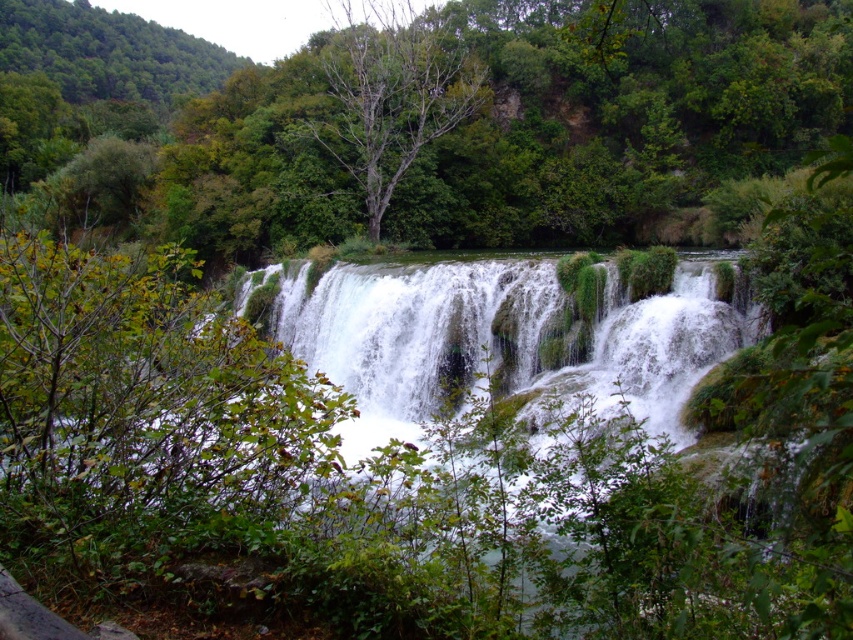
Can you confirm if green leafy tree at center is positioned to the left of bare wood tree at center?

Indeed, green leafy tree at center is positioned on the left side of bare wood tree at center.

Is the position of green leafy tree at center more distant than that of bare wood tree at center?

No, green leafy tree at center is in front of bare wood tree at center.

This screenshot has width=853, height=640. What do you see at coordinates (422, 120) in the screenshot? I see `green leafy tree at center` at bounding box center [422, 120].

This screenshot has height=640, width=853. What are the coordinates of `green leafy tree at center` in the screenshot? It's located at (422, 120).

Between point (488, 259) and point (422, 144), which one is positioned in front?

Point (488, 259)

Does white frothy water at center have a larger size compared to bare wood tree at center?

No, white frothy water at center is not bigger than bare wood tree at center.

Is point (659, 378) farther from viewer compared to point (338, 124)?

No, it is in front of (338, 124).

The image size is (853, 640). I want to click on white frothy water at center, so click(492, 337).

Who is positioned more to the right, green leafy tree at center or white frothy water at center?

white frothy water at center

Is green leafy tree at center smaller than white frothy water at center?

No, green leafy tree at center is not smaller than white frothy water at center.

Does point (344, 157) come farther from viewer compared to point (602, 369)?

Yes, it is behind point (602, 369).

Where is `green leafy tree at center`? green leafy tree at center is located at coordinates (422, 120).